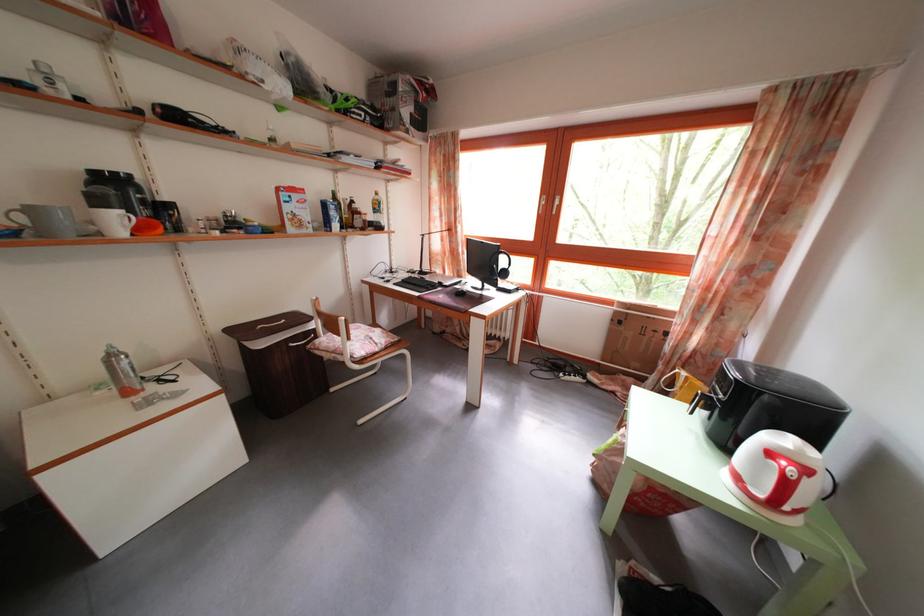
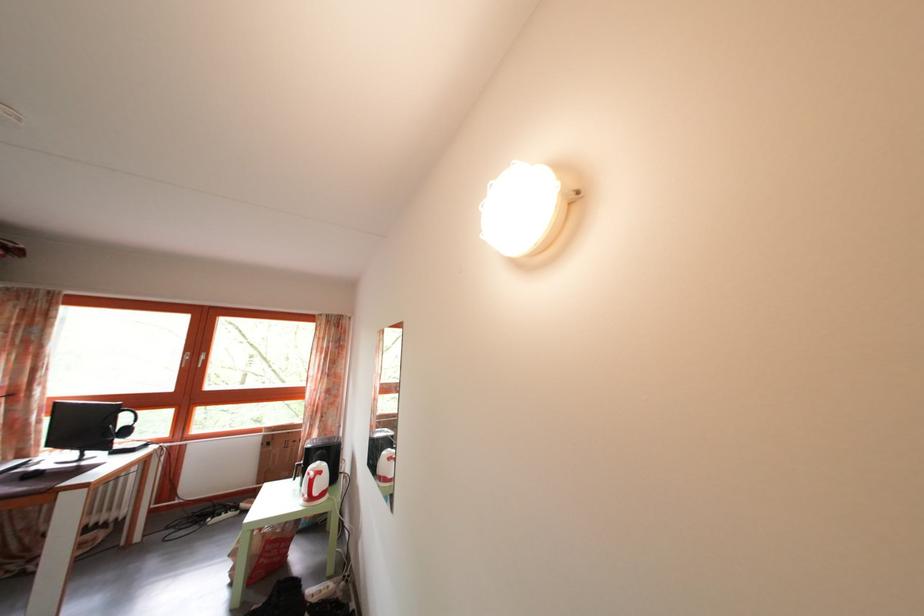
In the second image, find the point that corresponds to pixel 579 373 in the first image.

(233, 514)